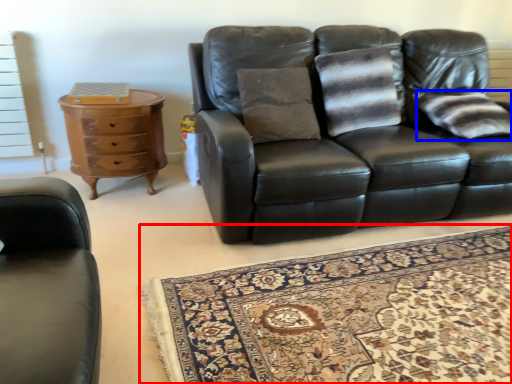
Question: Which object appears closest to the camera in this image, mat (highlighted by a red box) or pillow (highlighted by a blue box)?

Choices:
 (A) mat
 (B) pillow

Answer: (A)